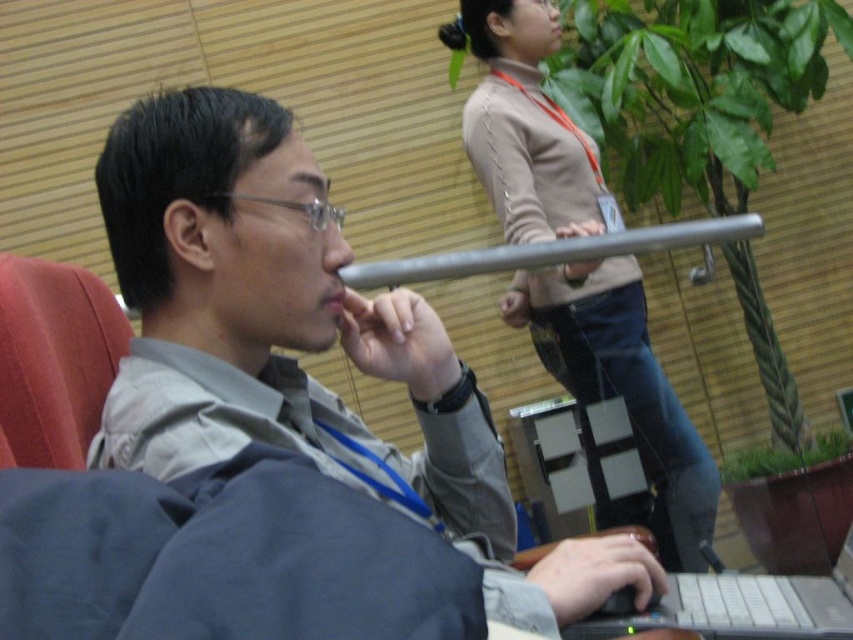
You are a photographer taking a picture of the scene. You want to ensure both the gray fabric shirt at center and the black plastic laptop at lower right are in focus. Which object should you adjust your camera focus to prioritize to capture both clearly?

To ensure both the gray fabric shirt at center and the black plastic laptop at lower right are in focus, prioritize focusing on the gray fabric shirt at center since it is closer to the viewer. This will increase the chances of the laptop in the background being within the depth of field.

You are an event organizer checking the seating arrangement. You need to ensure that the gray fabric shirt at center and the beige sweater at upper center are visible to the camera positioned at the back of the room. Which clothing item is shorter and might require adjusting its position to be seen better?

The gray fabric shirt at center is shorter than the beige sweater at upper center. To ensure visibility, the gray fabric shirt at center should be moved forward or elevated so it is visible to the camera.

You are an interior designer assessing the spatial arrangement of the room. Considering the beige sweater at upper center and the black plastic laptop at lower right, which object occupies a higher vertical position in the image?

The beige sweater at upper center is taller than the black plastic laptop at lower right, so it occupies a higher vertical position in the image.